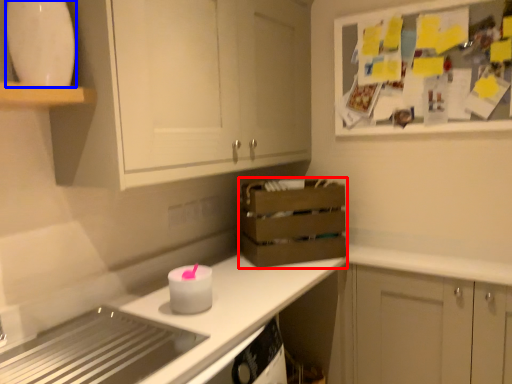
Question: Which of the following is the closest to the observer, crate (highlighted by a red box) or appliance (highlighted by a blue box)?

Choices:
 (A) crate
 (B) appliance

Answer: (B)